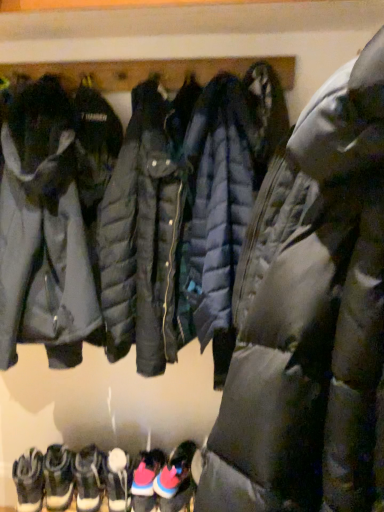
Question: Should I look upward or downward to see pink suede sneakers at lower center, the fifth footwear positioned from the left?

Choices:
 (A) up
 (B) down

Answer: (B)

Question: Should I look upward or downward to see pink suede sneakers at lower center, which appears as the 1th footwear when viewed from the right?

Choices:
 (A) down
 (B) up

Answer: (A)

Question: Is white suede boots at lower left, the fifth footwear when ordered from right to left, to the left of pink suede sneakers at lower center, which appears as the 1th footwear when viewed from the right, from the viewer's perspective?

Choices:
 (A) no
 (B) yes

Answer: (B)

Question: Considering the relative positions of white suede boots at lower left, the fifth footwear when ordered from right to left, and pink suede sneakers at lower center, which appears as the 1th footwear when viewed from the right, in the image provided, is white suede boots at lower left, the fifth footwear when ordered from right to left, to the right of pink suede sneakers at lower center, which appears as the 1th footwear when viewed from the right, from the viewer's perspective?

Choices:
 (A) no
 (B) yes

Answer: (A)

Question: Is white suede boots at lower left, the fifth footwear when ordered from right to left, positioned with its back to pink suede sneakers at lower center, which appears as the 1th footwear when viewed from the right?

Choices:
 (A) no
 (B) yes

Answer: (A)

Question: Is white suede boots at lower left, the fifth footwear when ordered from right to left, taller than pink suede sneakers at lower center, which appears as the 1th footwear when viewed from the right?

Choices:
 (A) yes
 (B) no

Answer: (A)

Question: Considering the relative sizes of white suede boots at lower left, the fifth footwear when ordered from right to left, and pink suede sneakers at lower center, which appears as the 1th footwear when viewed from the right, in the image provided, is white suede boots at lower left, the fifth footwear when ordered from right to left, shorter than pink suede sneakers at lower center, which appears as the 1th footwear when viewed from the right,?

Choices:
 (A) yes
 (B) no

Answer: (B)

Question: From a real-world perspective, is white suede boots at lower left, the 2th footwear in the left-to-right sequence, on pink suede sneakers at lower center, the sixth footwear from the left?

Choices:
 (A) yes
 (B) no

Answer: (A)

Question: Does white suede boots at lower left, the 2th footwear in the left-to-right sequence, come in front of white leather sneakers at lower left, which ranks as the 3th footwear in left-to-right order?

Choices:
 (A) no
 (B) yes

Answer: (B)

Question: Considering the relative sizes of white suede boots at lower left, the fifth footwear when ordered from right to left, and white leather sneakers at lower left, which ranks as the 3th footwear in left-to-right order, in the image provided, is white suede boots at lower left, the fifth footwear when ordered from right to left, taller than white leather sneakers at lower left, which ranks as the 3th footwear in left-to-right order,?

Choices:
 (A) no
 (B) yes

Answer: (B)

Question: Is white suede boots at lower left, the 2th footwear in the left-to-right sequence, at the right side of white leather sneakers at lower left, arranged as the 4th footwear when viewed from the right?

Choices:
 (A) yes
 (B) no

Answer: (B)

Question: From a real-world perspective, is white suede boots at lower left, the 2th footwear in the left-to-right sequence, located higher than white leather sneakers at lower left, arranged as the 4th footwear when viewed from the right?

Choices:
 (A) no
 (B) yes

Answer: (A)

Question: Is white suede boots at lower left, the fifth footwear when ordered from right to left, smaller than white leather sneakers at lower left, which ranks as the 3th footwear in left-to-right order?

Choices:
 (A) no
 (B) yes

Answer: (A)

Question: Is white suede boots at lower left, the 2th footwear in the left-to-right sequence, thinner than white leather sneakers at lower left, arranged as the 4th footwear when viewed from the right?

Choices:
 (A) no
 (B) yes

Answer: (A)

Question: Is white suede boots at lower left, the fifth footwear when ordered from right to left, surrounded by white fuzzy socks at lower left, which is counted as the 6th footwear, starting from the right?

Choices:
 (A) no
 (B) yes

Answer: (A)